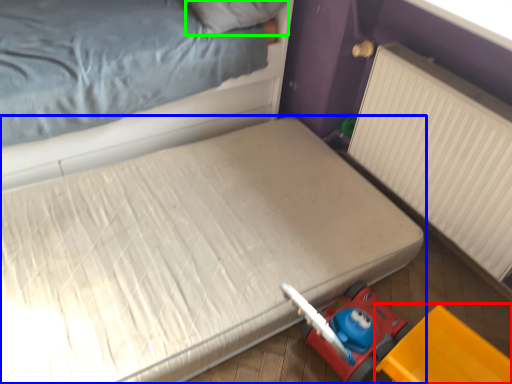
Question: Which is nearer to the equipment (highlighted by a red box)? bed (highlighted by a blue box) or pillow (highlighted by a green box).

Choices:
 (A) bed
 (B) pillow

Answer: (A)